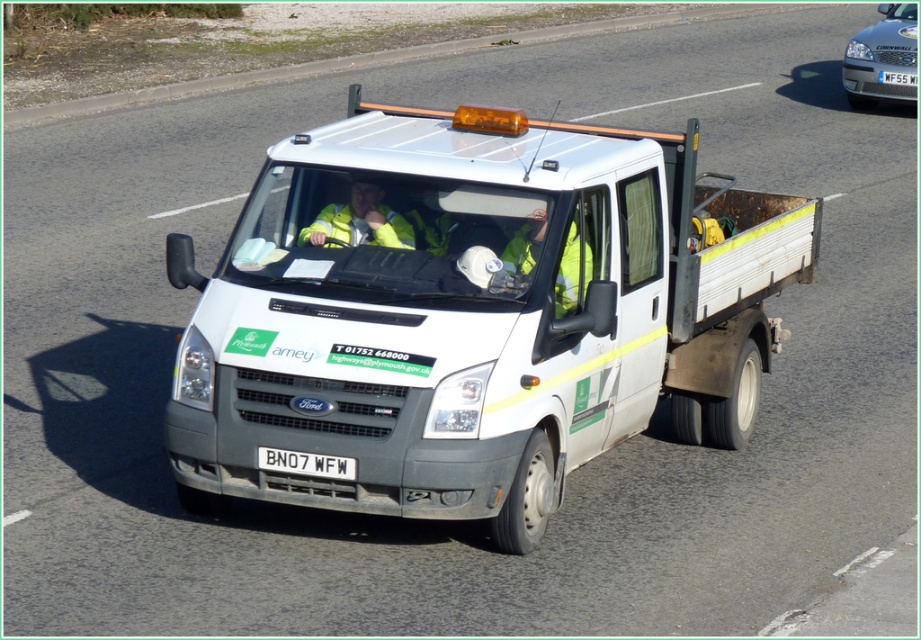
You are a traffic officer observing the scene. You notice a silver metallic car at upper right and a white plastic license plate at upper right. Which object is taller?

The silver metallic car at upper right is taller than the white plastic license plate at upper right according to the description.

You are a traffic officer inspecting a vehicle. You notice the yellow reflective vest at center and the white plastic license plate at upper right. Which object is positioned to the left when viewed from the front of the van?

The yellow reflective vest at center is to the left of the white plastic license plate at upper right.